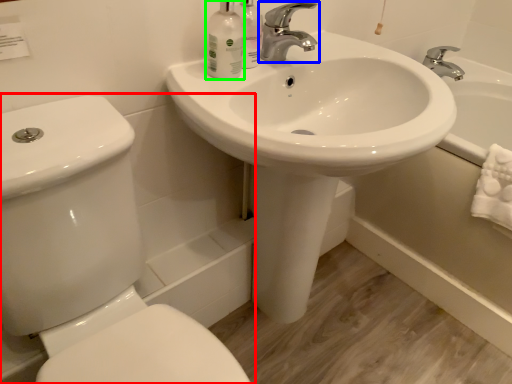
Question: Which object is the closest to the toilet (highlighted by a red box)? Choose among these: tap (highlighted by a blue box) or mouthwash (highlighted by a green box).

Choices:
 (A) tap
 (B) mouthwash

Answer: (B)